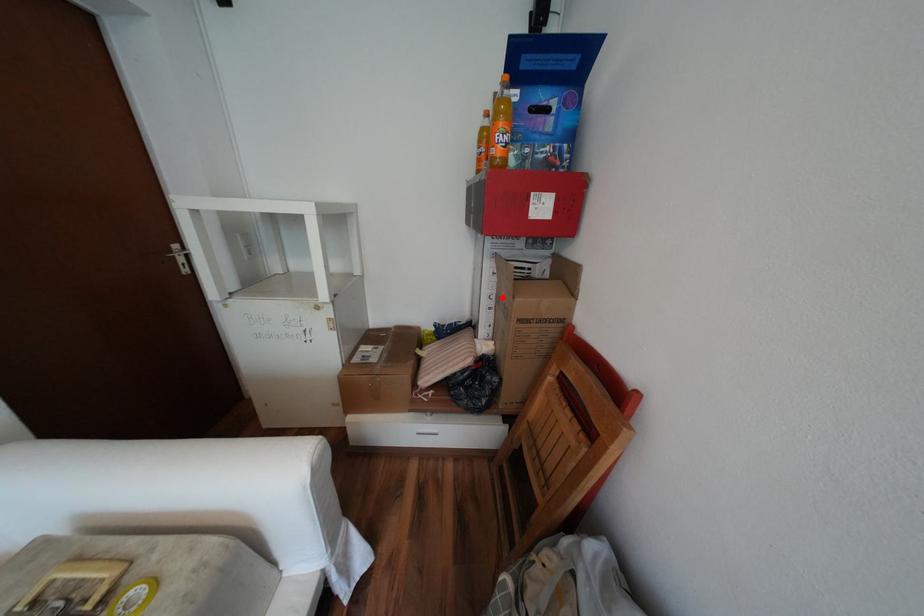
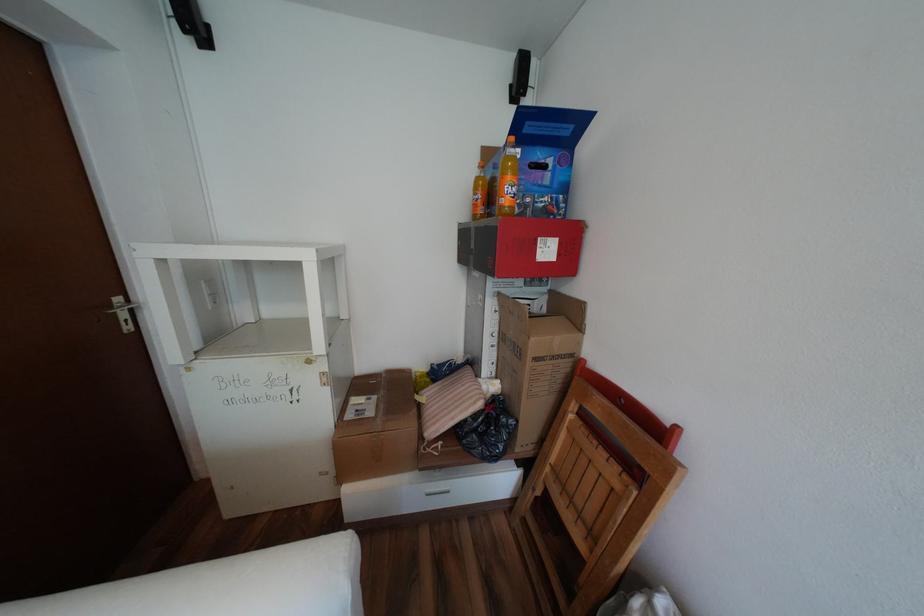
In the second image, find the point that corresponds to the highlighted location in the first image.

(505, 334)